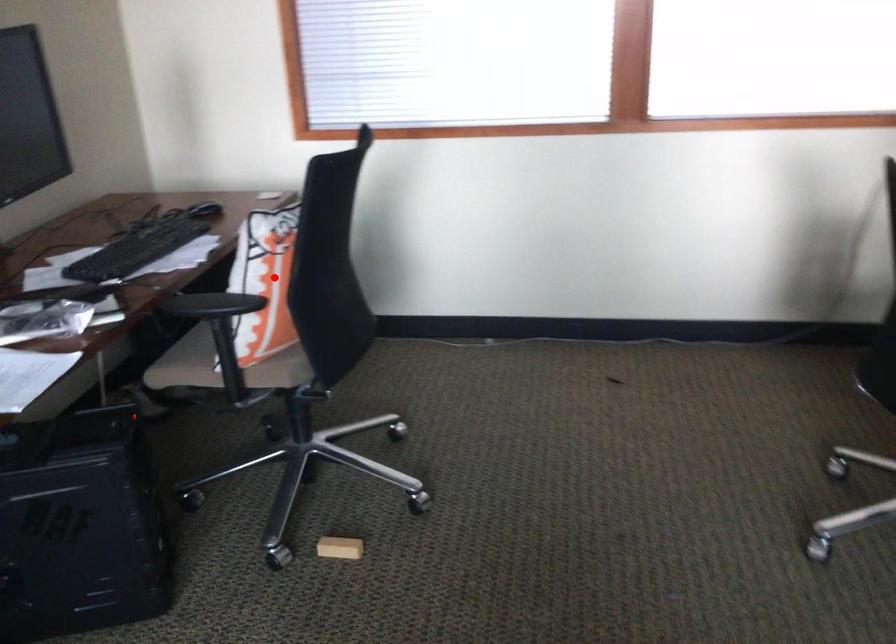
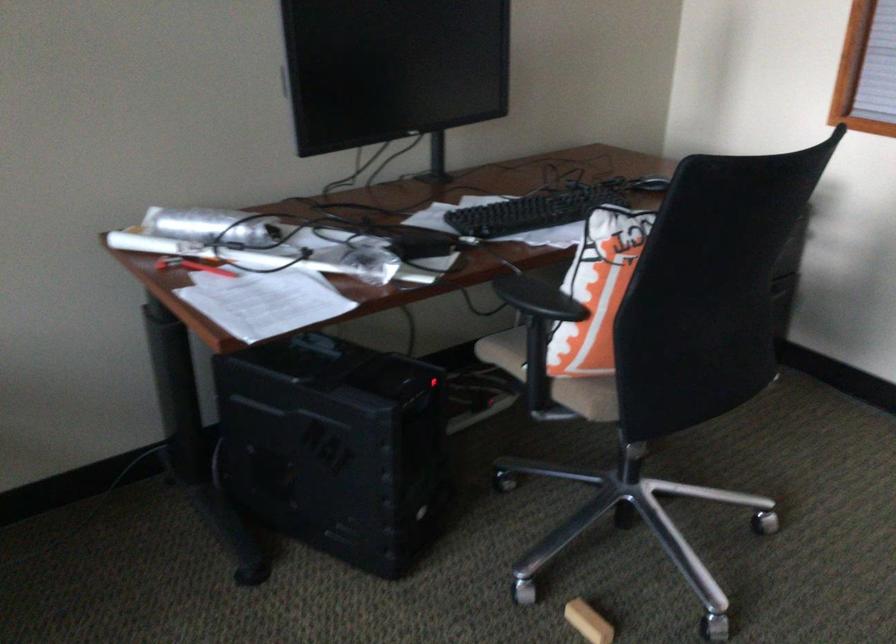
Locate, in the second image, the point that corresponds to the highlighted location in the first image.

(597, 290)